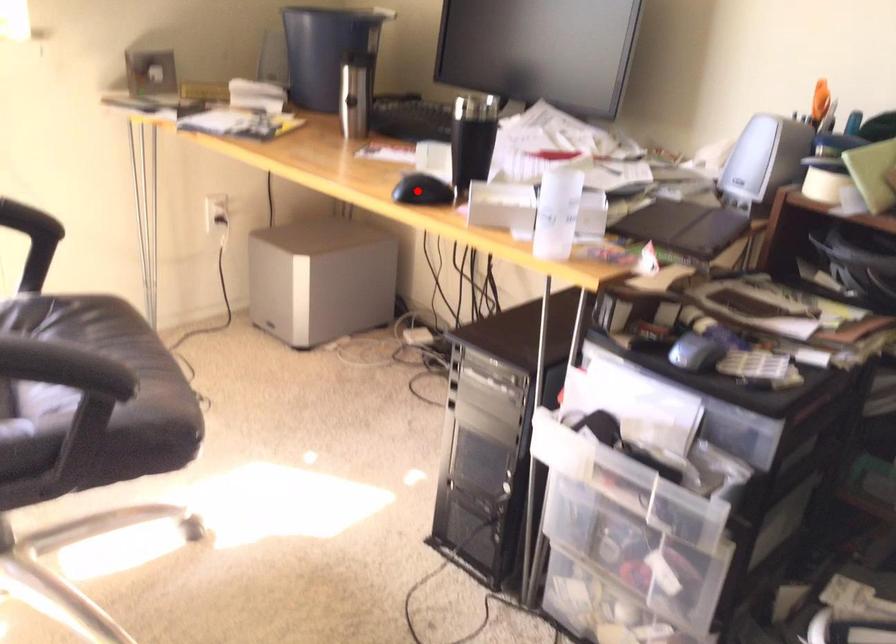
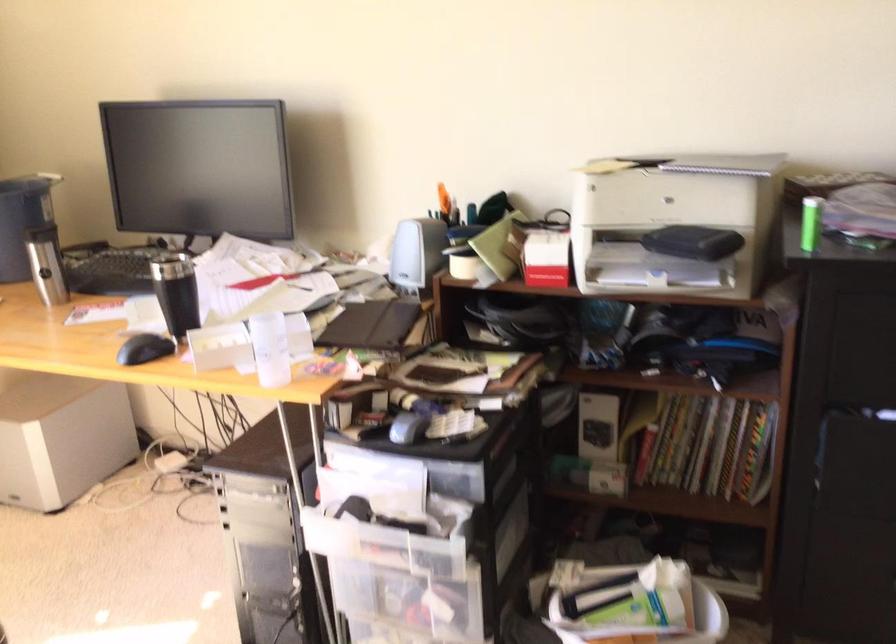
Question: I am providing you with two images of the same scene from different viewpoints. In image1, a red point is highlighted. Considering the same 3D point in image2, which of the following is correct?

Choices:
 (A) It is closer
 (B) It is farther

Answer: (B)